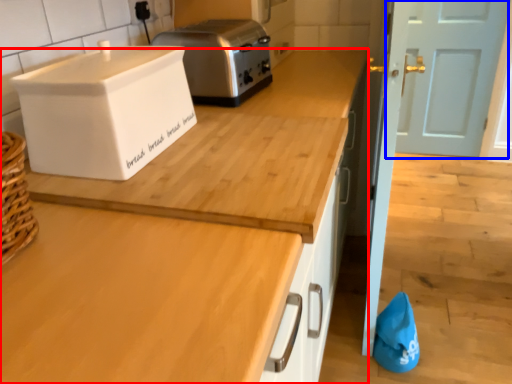
Question: Which object appears closest to the camera in this image, countertop (highlighted by a red box) or door (highlighted by a blue box)?

Choices:
 (A) countertop
 (B) door

Answer: (A)